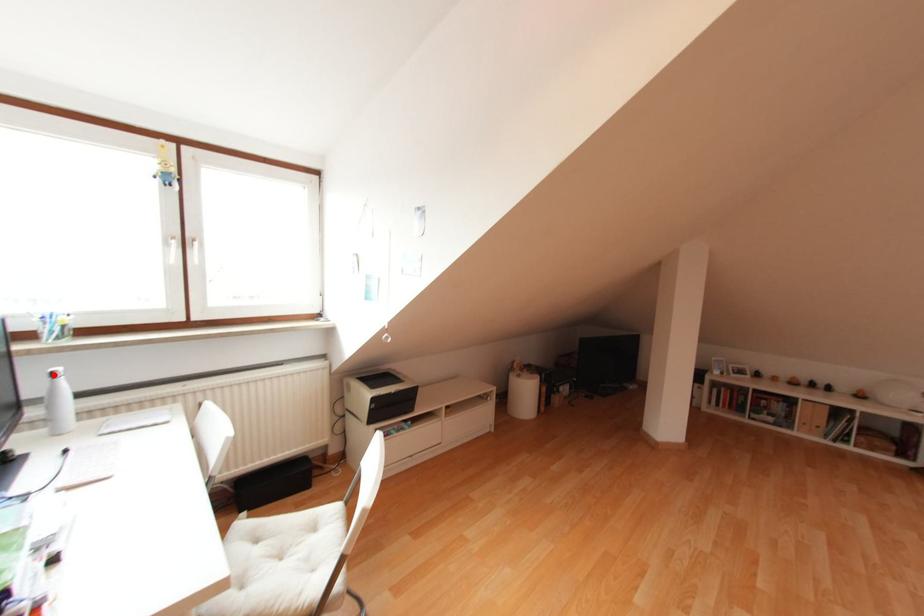
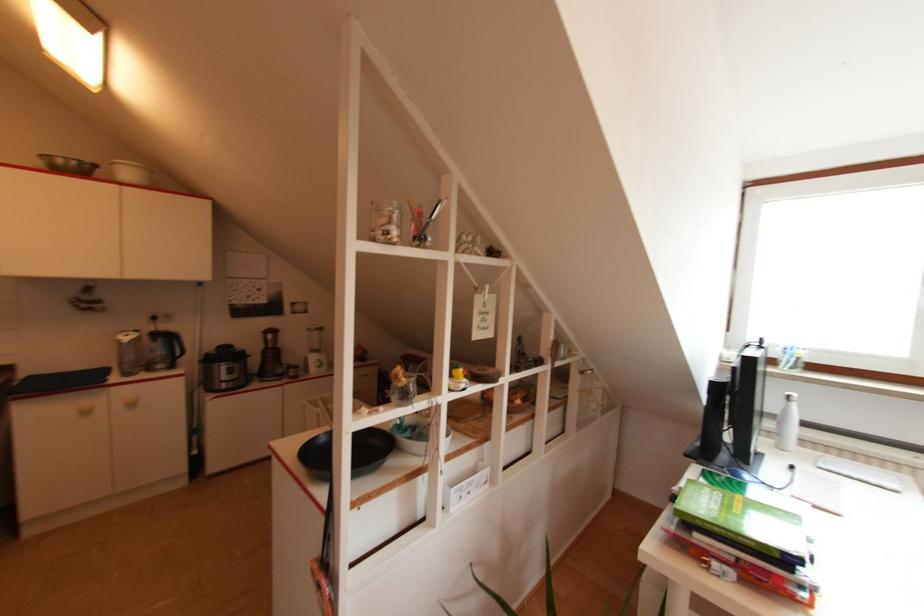
Find the pixel in the second image that matches the highlighted location in the first image.

(787, 399)